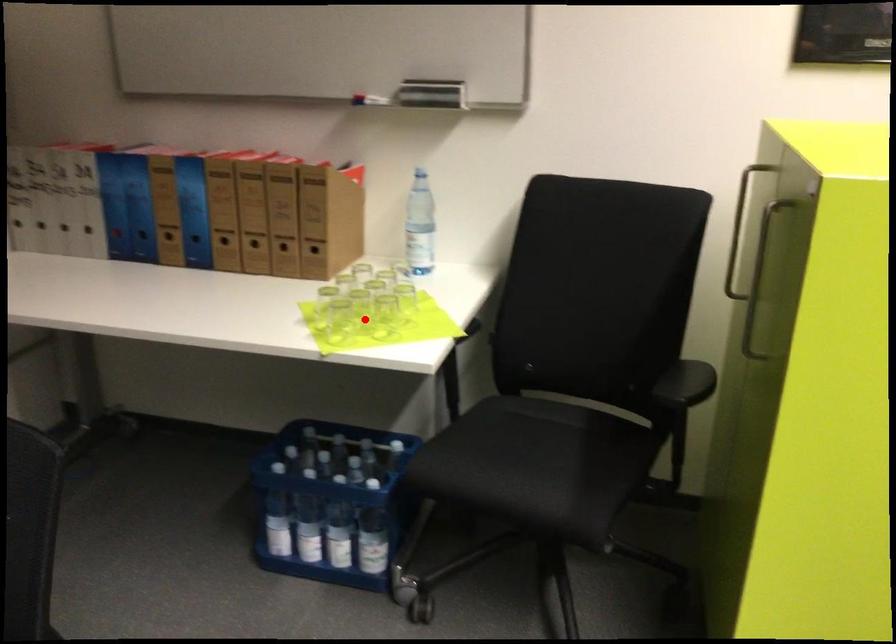
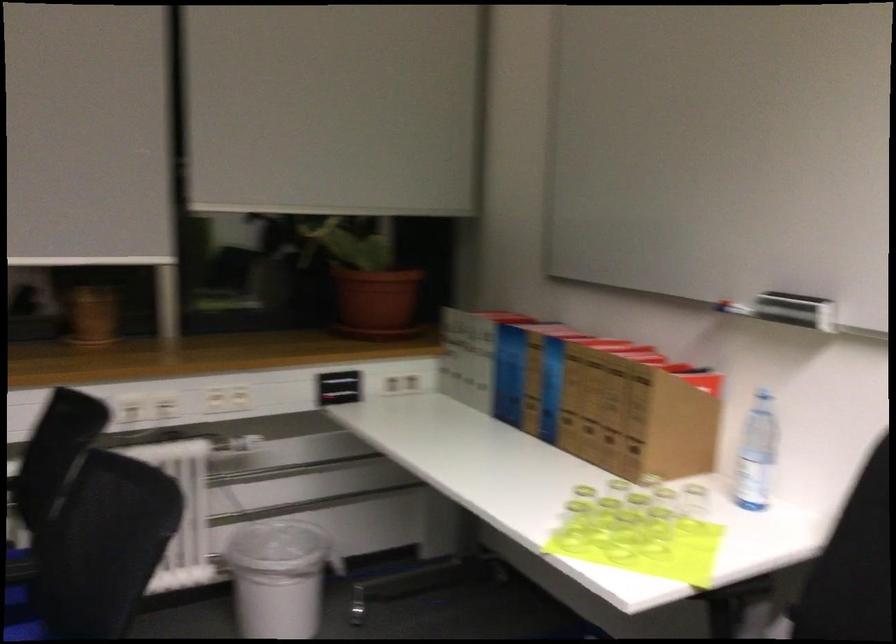
Locate, in the second image, the point that corresponds to the highlighted location in the first image.

(623, 536)